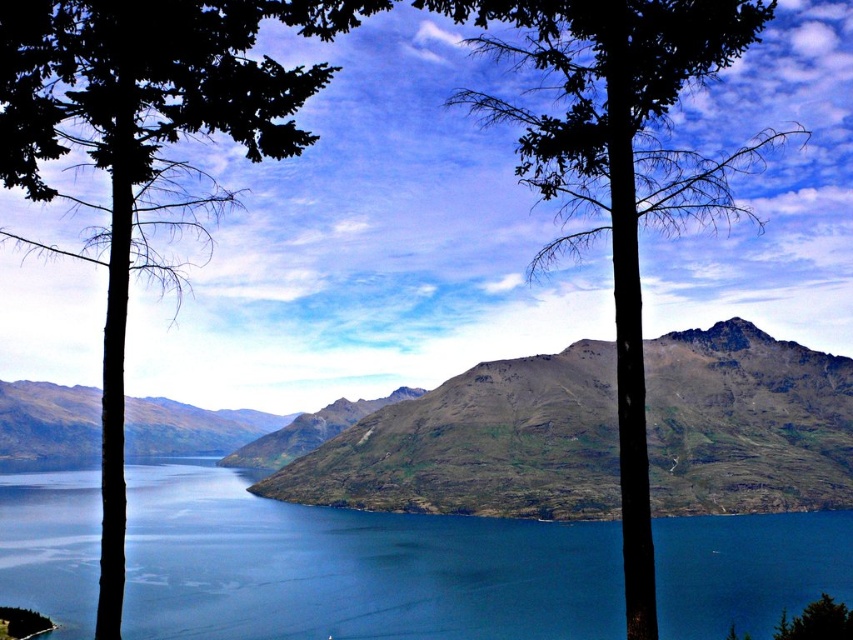
Can you confirm if blue water at center is positioned above rugged rock mountain at center?

Incorrect, blue water at center is not positioned above rugged rock mountain at center.

From the picture: Does blue water at center appear on the right side of rugged rock mountain at center?

In fact, blue water at center is to the left of rugged rock mountain at center.

The width and height of the screenshot is (853, 640). Identify the location of blue water at center. (352, 568).

Does point (328, 556) come farther from viewer compared to point (47, 124)?

Yes, point (328, 556) is farther from viewer.

Can you confirm if blue water at center is taller than dark green leafy tree at left?

No, blue water at center is not taller than dark green leafy tree at left.

Who is more forward, (329, 561) or (206, 120)?

Point (206, 120) is more forward.

The height and width of the screenshot is (640, 853). I want to click on blue water at center, so click(352, 568).

Which of these two, dark green leafy tree at left or green leafy tree at center, stands shorter?

dark green leafy tree at left

Is dark green leafy tree at left taller than green leafy tree at center?

No.

In order to click on dark green leafy tree at left in this screenshot , I will do `click(144, 147)`.